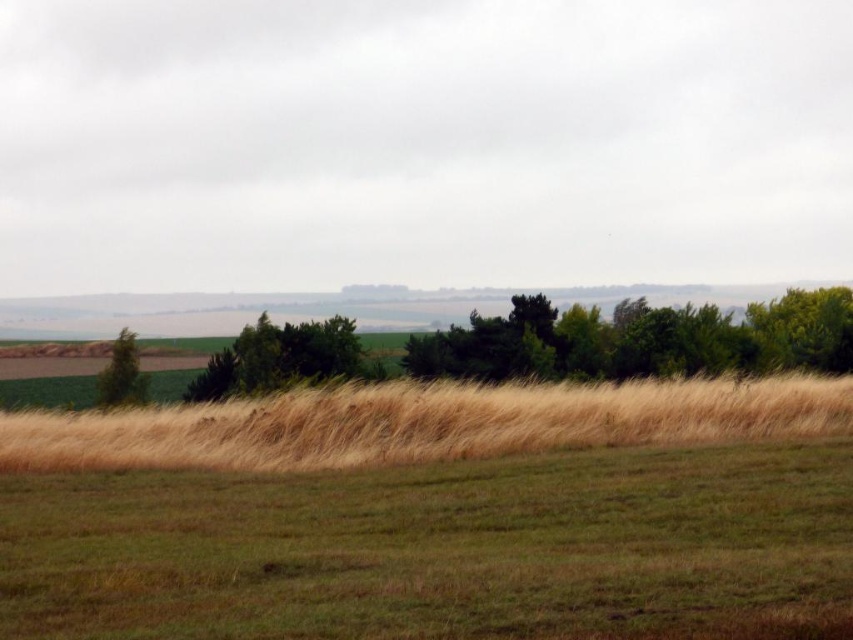
You are standing in the rural landscape and want to take a photo of the green leafy trees at center and the green matte tree at left. Which tree should you zoom in more on to capture their details clearly?

You should zoom in more on the green matte tree at left because it is smaller in size compared to the green leafy trees at center.

You are standing in the rural landscape and want to walk from the point at coordinates point (x=328, y=369) to the point at coordinates point (x=120, y=372). Which direction should you move to get closer to your destination?

You should move towards the bottom of the image because point (x=328, y=369) is further to the viewer than point (x=120, y=372), so moving downward in the image will take you closer to the destination.

Looking at this image, you are standing in the rural landscape and want to walk towards the green leafy tree at right and the green matte tree at left. Which tree will you reach first?

You will reach the green leafy tree at right first because it is closer to you than the green matte tree at left, which is further away.